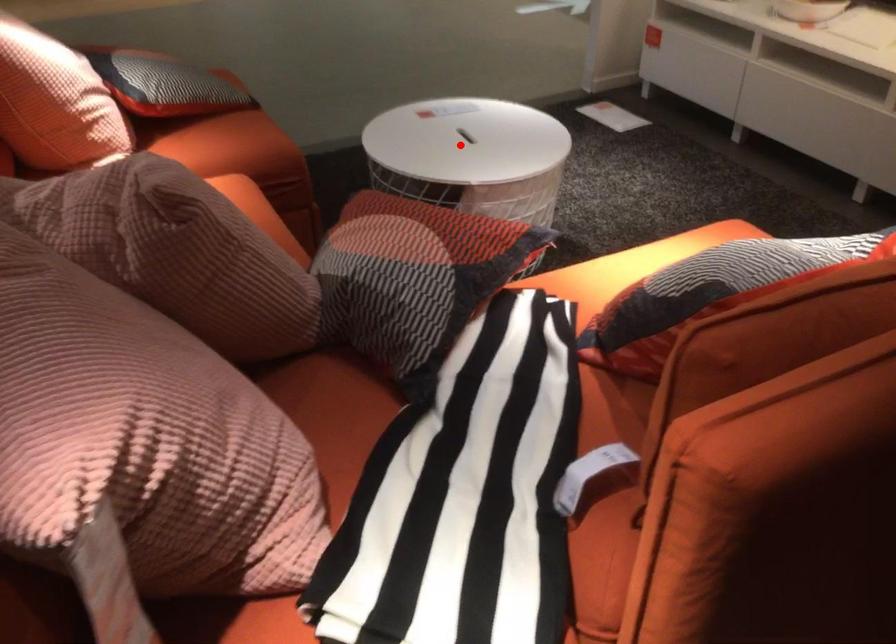
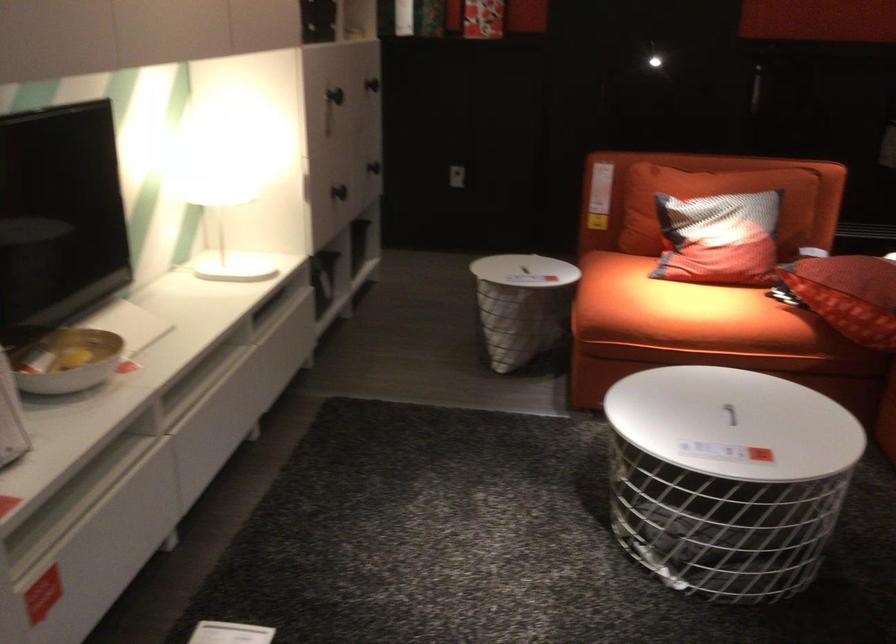
Question: I am providing you with two images of the same scene from different viewpoints. Image1 has a red point marked. In image2, the corresponding 3D location appears at what relative position? Reply with the corresponding letter.

Choices:
 (A) Closer
 (B) Farther

Answer: (A)